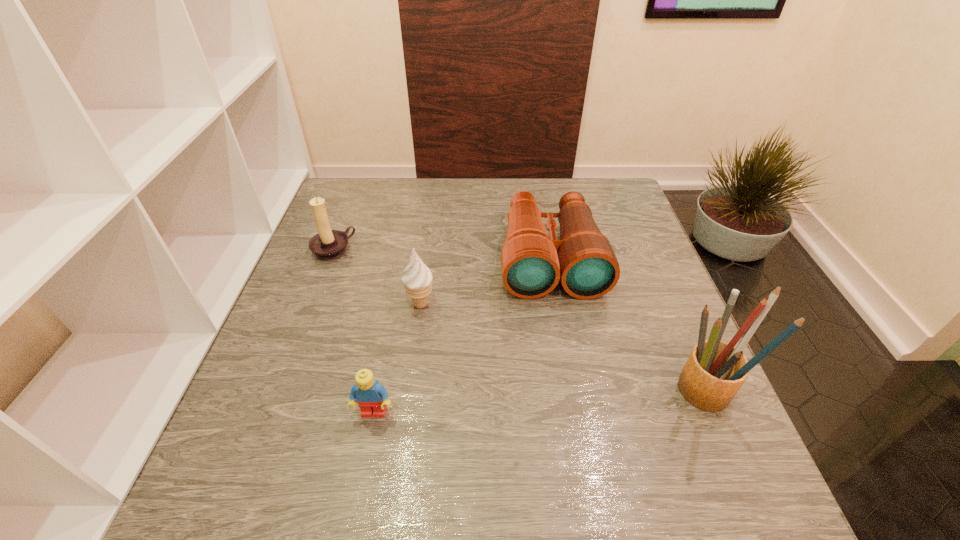
Identify which object is the second nearest to the rightmost object. Please provide its 2D coordinates. Your answer should be formatted as a tuple, i.e. [(x, y)], where the tuple contains the x and y coordinates of a point satisfying the conditions above.

[(417, 279)]

Image resolution: width=960 pixels, height=540 pixels. Find the location of `vacant area that satisfies the following two spatial constraints: 1. on the front side of the pencil box; 2. on the left side of the fourth tallest object`. vacant area that satisfies the following two spatial constraints: 1. on the front side of the pencil box; 2. on the left side of the fourth tallest object is located at coordinates (574, 394).